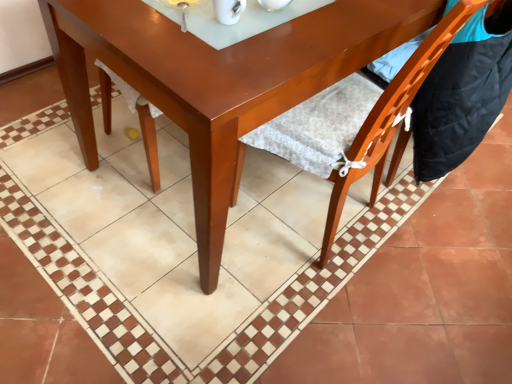
Find the location of `orange wood chair at lower right, the second chair positioned from the left`. orange wood chair at lower right, the second chair positioned from the left is located at coordinates (463, 93).

What do you see at coordinates (220, 79) in the screenshot?
I see `glossy wood table at center` at bounding box center [220, 79].

Where is `wooden chair at lower right, arranged as the first chair when viewed from the left`? This screenshot has width=512, height=384. wooden chair at lower right, arranged as the first chair when viewed from the left is located at coordinates (390, 117).

Find the location of a particular element. This screenshot has height=384, width=512. orange wood chair at lower right, which is the first chair from right to left is located at coordinates pyautogui.click(x=463, y=93).

Between orange wood chair at lower right, which is the first chair from right to left, and wooden chair at lower right, positioned as the second chair in right-to-left order, which one has more height?

wooden chair at lower right, positioned as the second chair in right-to-left order, is taller.

Is orange wood chair at lower right, which is the first chair from right to left, directly adjacent to wooden chair at lower right, arranged as the first chair when viewed from the left?

No, orange wood chair at lower right, which is the first chair from right to left, is not touching wooden chair at lower right, arranged as the first chair when viewed from the left.

Does point (459, 38) appear closer or farther from the camera than point (383, 124)?

Point (459, 38).

This screenshot has height=384, width=512. Identify the location of chair that appears on the right of wooden chair at lower right, arranged as the first chair when viewed from the left. (463, 93).

Is point (397, 156) less distant than point (218, 165)?

No, it is not.

From the image's perspective, starting from the glossy wood table at center, which chair is the 2nd one below? Please provide its 2D coordinates.

[(390, 117)]

Is glossy wood table at center at the back of wooden chair at lower right, positioned as the second chair in right-to-left order?

wooden chair at lower right, positioned as the second chair in right-to-left order, is not turned away from glossy wood table at center.

Can you confirm if wooden chair at lower right, positioned as the second chair in right-to-left order, is taller than glossy wood table at center?

Correct, wooden chair at lower right, positioned as the second chair in right-to-left order, is much taller as glossy wood table at center.

Measure the distance between glossy wood table at center and orange wood chair at lower right, which is the first chair from right to left.

46.51 centimeters.

Locate an element on the screen. The height and width of the screenshot is (384, 512). round table that appears below the orange wood chair at lower right, which is the first chair from right to left (from a real-world perspective) is located at coordinates (220, 79).

Relative to orange wood chair at lower right, which is the first chair from right to left, is glossy wood table at center in front or behind?

glossy wood table at center is in front of orange wood chair at lower right, which is the first chair from right to left.

Can you confirm if glossy wood table at center is bigger than orange wood chair at lower right, which is the first chair from right to left?

Yes.

Is wooden chair at lower right, positioned as the second chair in right-to-left order, facing towards orange wood chair at lower right, the second chair positioned from the left?

No.

Measure the distance between wooden chair at lower right, positioned as the second chair in right-to-left order, and orange wood chair at lower right, which is the first chair from right to left.

wooden chair at lower right, positioned as the second chair in right-to-left order, is 24.22 centimeters away from orange wood chair at lower right, which is the first chair from right to left.

Considering the relative sizes of wooden chair at lower right, arranged as the first chair when viewed from the left, and orange wood chair at lower right, which is the first chair from right to left, in the image provided, is wooden chair at lower right, arranged as the first chair when viewed from the left, smaller than orange wood chair at lower right, which is the first chair from right to left,?

No, wooden chair at lower right, arranged as the first chair when viewed from the left, is not smaller than orange wood chair at lower right, which is the first chair from right to left.

Is wooden chair at lower right, positioned as the second chair in right-to-left order, next to orange wood chair at lower right, the second chair positioned from the left?

No.

How many degrees apart are the facing directions of orange wood chair at lower right, which is the first chair from right to left, and glossy wood table at center?

The angular difference between orange wood chair at lower right, which is the first chair from right to left, and glossy wood table at center is 0.663 degrees.

Considering the sizes of orange wood chair at lower right, the second chair positioned from the left, and glossy wood table at center in the image, is orange wood chair at lower right, the second chair positioned from the left, taller or shorter than glossy wood table at center?

orange wood chair at lower right, the second chair positioned from the left, is shorter than glossy wood table at center.

Considering their positions, is orange wood chair at lower right, the second chair positioned from the left, located in front of or behind glossy wood table at center?

Visually, orange wood chair at lower right, the second chair positioned from the left, is located behind glossy wood table at center.

Based on the photo, which of these two, glossy wood table at center or wooden chair at lower right, positioned as the second chair in right-to-left order, is wider?

With larger width is glossy wood table at center.

Which object is further away from the camera taking this photo, glossy wood table at center or wooden chair at lower right, positioned as the second chair in right-to-left order?

glossy wood table at center is further from the camera.

Is glossy wood table at center inside or outside of wooden chair at lower right, arranged as the first chair when viewed from the left?

glossy wood table at center is located beyond the bounds of wooden chair at lower right, arranged as the first chair when viewed from the left.

Is wooden chair at lower right, arranged as the first chair when viewed from the left, at the back of glossy wood table at center?

Yes, glossy wood table at center's orientation is away from wooden chair at lower right, arranged as the first chair when viewed from the left.

This screenshot has width=512, height=384. What are the coordinates of `chair located underneath the wooden chair at lower right, positioned as the second chair in right-to-left order (from a real-world perspective)` in the screenshot? It's located at (463, 93).

Find the location of `round table above the wooden chair at lower right, arranged as the first chair when viewed from the left (from the image's perspective)`. round table above the wooden chair at lower right, arranged as the first chair when viewed from the left (from the image's perspective) is located at coordinates (220, 79).

Which object lies nearer to the anchor point orange wood chair at lower right, the second chair positioned from the left, wooden chair at lower right, arranged as the first chair when viewed from the left, or glossy wood table at center?

Based on the image, wooden chair at lower right, arranged as the first chair when viewed from the left, appears to be nearer to orange wood chair at lower right, the second chair positioned from the left.

Based on the photo, from the image, which object appears to be farther from wooden chair at lower right, positioned as the second chair in right-to-left order, orange wood chair at lower right, which is the first chair from right to left, or glossy wood table at center?

glossy wood table at center lies further to wooden chair at lower right, positioned as the second chair in right-to-left order, than the other object.

Which object lies nearer to the anchor point wooden chair at lower right, arranged as the first chair when viewed from the left, glossy wood table at center or orange wood chair at lower right, which is the first chair from right to left?

orange wood chair at lower right, which is the first chair from right to left.

In the scene shown: Estimate the real-world distances between objects in this image. Which object is further from glossy wood table at center, orange wood chair at lower right, which is the first chair from right to left, or wooden chair at lower right, positioned as the second chair in right-to-left order?

Among the two, orange wood chair at lower right, which is the first chair from right to left, is located further to glossy wood table at center.

Based on their spatial positions, is wooden chair at lower right, positioned as the second chair in right-to-left order, or orange wood chair at lower right, the second chair positioned from the left, closer to glossy wood table at center?

wooden chair at lower right, positioned as the second chair in right-to-left order, lies closer to glossy wood table at center than the other object.

In the scene shown: Looking at the image, which one is located further to orange wood chair at lower right, which is the first chair from right to left, glossy wood table at center or wooden chair at lower right, positioned as the second chair in right-to-left order?

glossy wood table at center is positioned further to the anchor orange wood chair at lower right, which is the first chair from right to left.

Identify the location of chair located between glossy wood table at center and orange wood chair at lower right, the second chair positioned from the left, in the left-right direction. (390, 117).